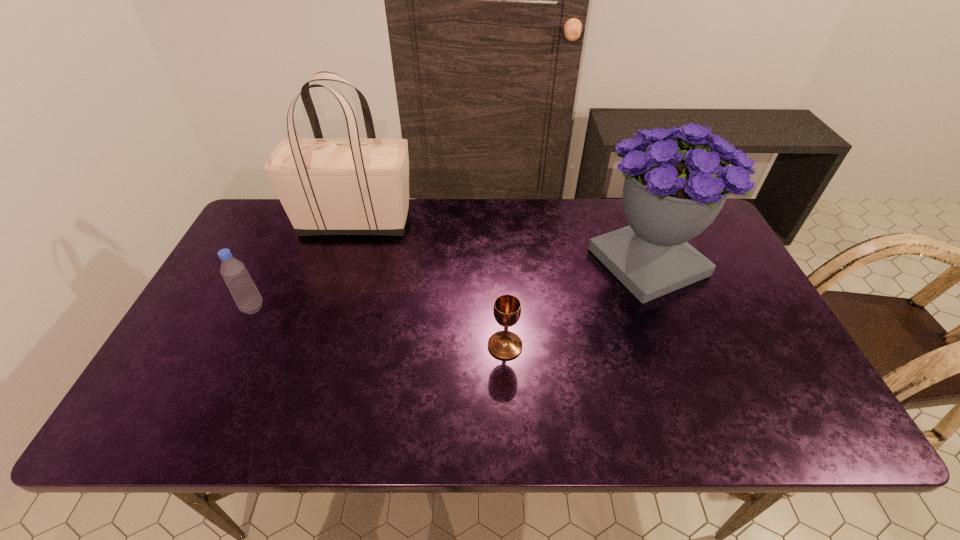
Locate an element on the screen. free space between the shortest object and the bouquet is located at coordinates (577, 304).

This screenshot has width=960, height=540. I want to click on vacant area that lies between the third object from left to right and the shopping bag, so click(x=430, y=284).

Where is `unoccupied area between the bouquet and the shopping bag`? The image size is (960, 540). unoccupied area between the bouquet and the shopping bag is located at coordinates (502, 242).

At what (x,y) coordinates should I click in order to perform the action: click on empty location between the chalice and the shopping bag. Please return your answer as a coordinate pair (x, y). Looking at the image, I should click on (430, 284).

The height and width of the screenshot is (540, 960). I want to click on free space that is in between the shortest object and the shopping bag, so click(430, 284).

Locate an element on the screen. This screenshot has height=540, width=960. free space between the third tallest object and the shopping bag is located at coordinates (304, 265).

Identify the location of free space between the second shortest object and the shopping bag. This screenshot has height=540, width=960. (304, 265).

Identify the location of free space between the shopping bag and the second shortest object. (304, 265).

Identify the location of free point between the second shortest object and the bouquet. The height and width of the screenshot is (540, 960). (450, 285).

Find the location of a particular element. Image resolution: width=960 pixels, height=540 pixels. vacant space that is in between the shopping bag and the bouquet is located at coordinates (502, 242).